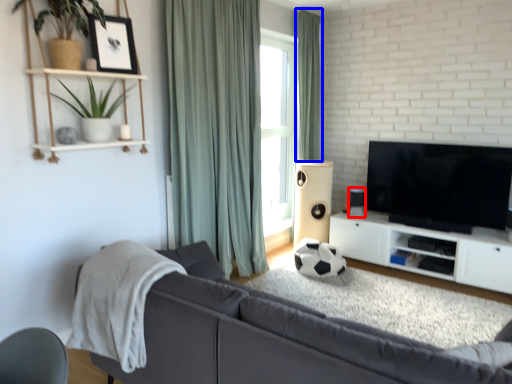
Question: Among these objects, which one is nearest to the camera, speaker (highlighted by a red box) or curtain (highlighted by a blue box)?

Choices:
 (A) speaker
 (B) curtain

Answer: (A)